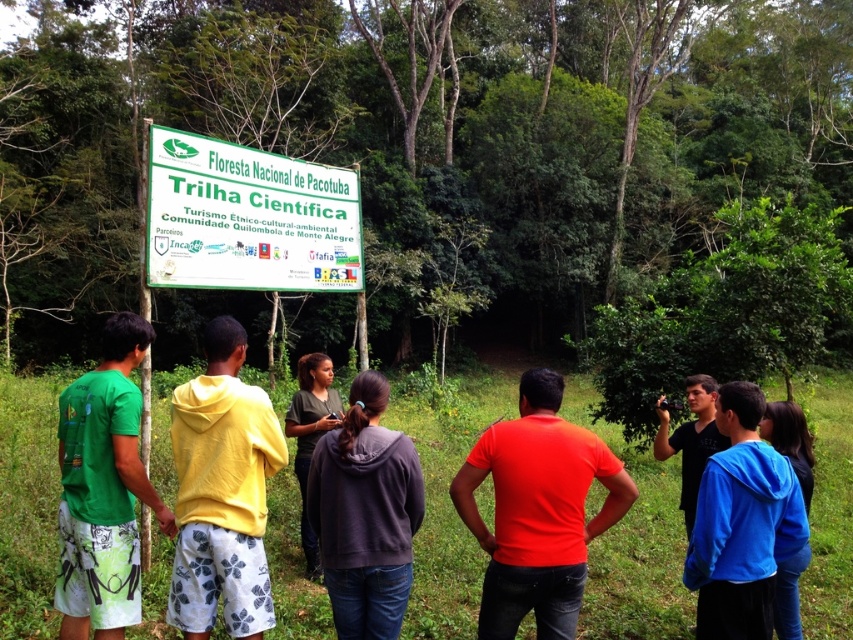
Is yellow cotton hoodie at center to the left of blue fleece jacket at lower right from the viewer's perspective?

Indeed, yellow cotton hoodie at center is positioned on the left side of blue fleece jacket at lower right.

Find the location of a particular element. Image resolution: width=853 pixels, height=640 pixels. yellow cotton hoodie at center is located at coordinates (222, 492).

Where is `yellow cotton hoodie at center`? The height and width of the screenshot is (640, 853). yellow cotton hoodie at center is located at coordinates (222, 492).

Identify the location of yellow cotton hoodie at center. This screenshot has height=640, width=853. (222, 492).

Who is lower down, green plastic sign at center or dark gray fabric shirt at center?

dark gray fabric shirt at center

Does point (283, 250) come in front of point (311, 403)?

No, it is not.

Image resolution: width=853 pixels, height=640 pixels. Identify the location of green plastic sign at center. (248, 218).

Does green plastic sign at center appear on the left side of black matte shirt at center?

Indeed, green plastic sign at center is positioned on the left side of black matte shirt at center.

Does green plastic sign at center have a larger size compared to black matte shirt at center?

Indeed, green plastic sign at center has a larger size compared to black matte shirt at center.

Who is more distant from viewer, (291,173) or (663,436)?

The point (291,173) is more distant.

The width and height of the screenshot is (853, 640). In order to click on green plastic sign at center in this screenshot , I will do `click(248, 218)`.